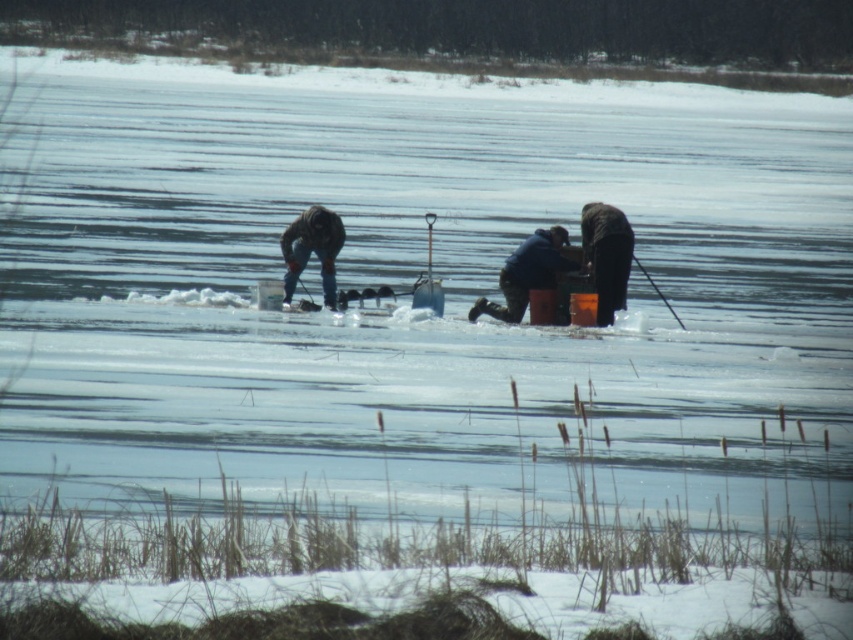
Question: Is blue fabric jacket at center to the right of black matte jacket at center from the viewer's perspective?

Choices:
 (A) no
 (B) yes

Answer: (A)

Question: Based on their relative distances, which object is nearer to the blue fabric jacket at center?

Choices:
 (A) dark gray jacket at center
 (B) black matte jacket at center

Answer: (B)

Question: From the image, what is the correct spatial relationship of black matte jacket at center in relation to dark gray jacket at center?

Choices:
 (A) left
 (B) right

Answer: (B)

Question: Does black matte jacket at center have a greater width compared to dark gray jacket at center?

Choices:
 (A) yes
 (B) no

Answer: (B)

Question: Which of the following is the farthest from the observer?

Choices:
 (A) (567, 260)
 (B) (293, 227)

Answer: (A)

Question: Which of the following is the closest to the observer?

Choices:
 (A) (519, 307)
 (B) (596, 314)

Answer: (B)